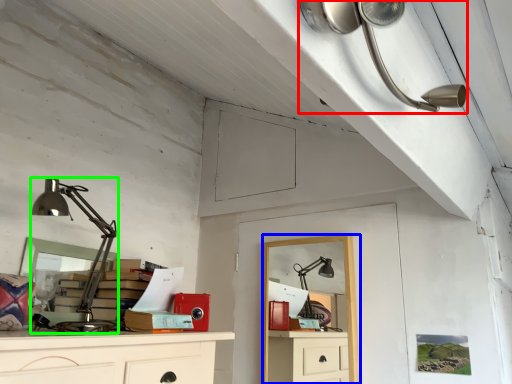
Question: Which object is the farthest from lamp (highlighted by a red box)? Choose among these: computer desk (highlighted by a blue box) or lamp (highlighted by a green box).

Choices:
 (A) computer desk
 (B) lamp

Answer: (B)